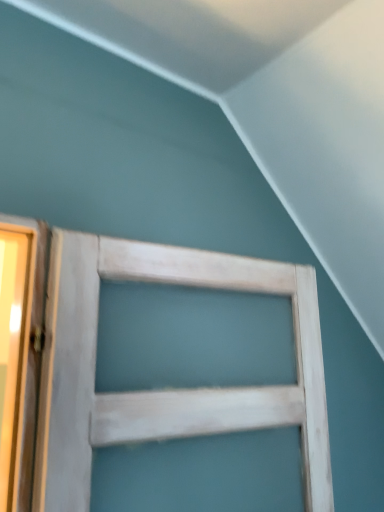
What do you see at coordinates (163, 391) in the screenshot? The width and height of the screenshot is (384, 512). I see `white wood door at center` at bounding box center [163, 391].

Where is `white wood door at center`? The height and width of the screenshot is (512, 384). white wood door at center is located at coordinates (163, 391).

Locate an element on the screen. Image resolution: width=384 pixels, height=512 pixels. white wood door at center is located at coordinates (163, 391).